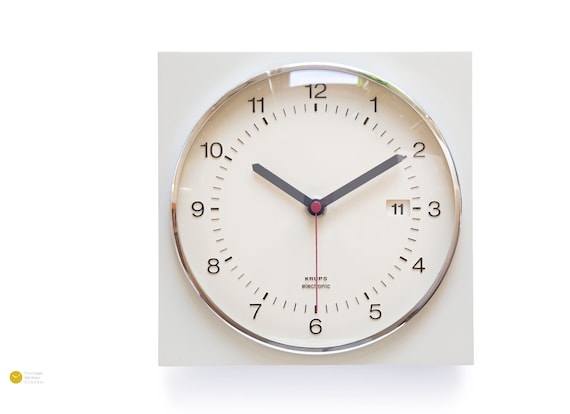
At what (x,y) coordinates should I click in order to perform the action: click on wall. Please return your answer as a coordinate pair (x, y). Looking at the image, I should click on (447, 90).